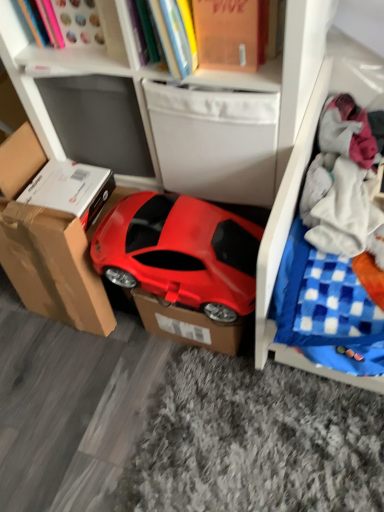
Question: Considering their positions, is matte white bookcase at upper center located in front of or behind orange matte book at upper center?

Choices:
 (A) front
 (B) behind

Answer: (A)

Question: Considering the relative positions of matte white bookcase at upper center and orange matte book at upper center in the image provided, is matte white bookcase at upper center to the left or to the right of orange matte book at upper center?

Choices:
 (A) left
 (B) right

Answer: (A)

Question: Which object is positioned farthest from the white matte drawer at center?

Choices:
 (A) matte plastic car at center
 (B) white plastic cabinet at upper center
 (C) brown cardboard box at left, the first cardboard box positioned from the left
 (D) white soft fabric at right
 (E) matte white bookcase at upper center

Answer: (C)

Question: Based on their relative distances, which object is farther from the brown cardboard box at left, arranged as the second cardboard box when viewed from the right?

Choices:
 (A) matte cardboard box at center, the second cardboard box from the left
 (B) white matte drawer at center
 (C) white plastic cabinet at upper center
 (D) matte white bookcase at upper center
 (E) matte plastic car at center

Answer: (C)